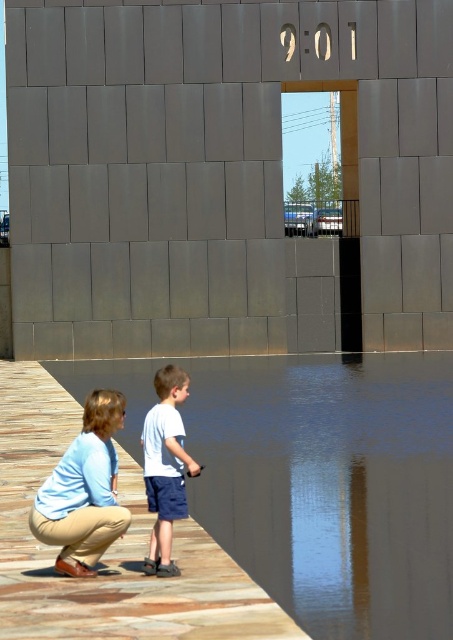
Question: Based on their relative distances, which object is farther from the light blue cotton shirt at lower left?

Choices:
 (A) wooden at lower left
 (B) white cotton shirt at center

Answer: (A)

Question: Can you confirm if light blue cotton shirt at lower left is positioned to the left of white cotton shirt at center?

Choices:
 (A) no
 (B) yes

Answer: (B)

Question: Which point is farther to the camera?

Choices:
 (A) (100, 502)
 (B) (149, 467)
 (C) (136, 500)

Answer: (C)

Question: Does wooden at lower left have a smaller size compared to light blue cotton shirt at lower left?

Choices:
 (A) no
 (B) yes

Answer: (A)

Question: Which point is farther from the camera taking this photo?

Choices:
 (A) (91, 570)
 (B) (218, 570)

Answer: (B)

Question: Does wooden at lower left lie behind light blue cotton shirt at lower left?

Choices:
 (A) no
 (B) yes

Answer: (A)